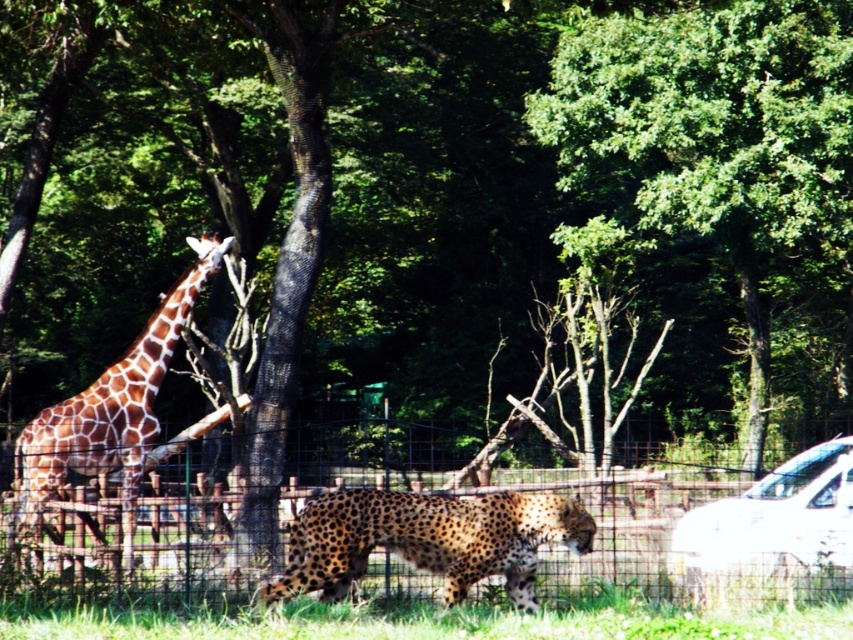
Question: Is white glossy car at lower right to the right of brown spotted giraffe at left from the viewer's perspective?

Choices:
 (A) no
 (B) yes

Answer: (B)

Question: Is metal wire fence at center wider than white glossy car at lower right?

Choices:
 (A) yes
 (B) no

Answer: (A)

Question: Considering the real-world distances, which object is closest to the green leafy tree at center?

Choices:
 (A) brown spotted giraffe at left
 (B) spotted fur cheetah at center

Answer: (A)

Question: Which point is closer to the camera taking this photo?

Choices:
 (A) (393, 513)
 (B) (74, 420)

Answer: (A)

Question: Does green leafy tree at center appear over metal wire fence at center?

Choices:
 (A) no
 (B) yes

Answer: (B)

Question: Among these objects, which one is nearest to the camera?

Choices:
 (A) green leafy tree at center
 (B) metal wire fence at center

Answer: (B)